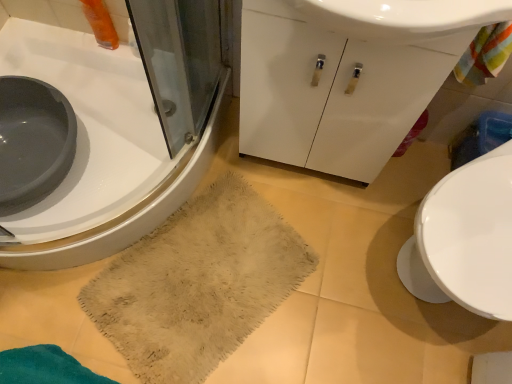
The image size is (512, 384). Find the location of `white glossy cabinet at center`. white glossy cabinet at center is located at coordinates (347, 75).

Where is `white glossy cabinet at center`? white glossy cabinet at center is located at coordinates (347, 75).

Is white glossy sink at lower left not within white glossy cabinet at center?

Yes, white glossy sink at lower left is outside of white glossy cabinet at center.

Which is more to the right, white glossy sink at lower left or white glossy cabinet at center?

Positioned to the right is white glossy cabinet at center.

Between white glossy sink at lower left and white glossy cabinet at center, which one has smaller width?

With smaller width is white glossy cabinet at center.

Visually, is white glossy sink at lower left positioned to the left or to the right of beige fuzzy rug at lower center?

white glossy sink at lower left is positioned on beige fuzzy rug at lower center's left side.

Is point (73, 101) less distant than point (149, 382)?

No, it is not.

Is white glossy sink at lower left not close to beige fuzzy rug at lower center?

No, there isn't a large distance between white glossy sink at lower left and beige fuzzy rug at lower center.

Does point (227, 191) come closer to viewer compared to point (386, 148)?

No, it is behind (386, 148).

What's the angular difference between beige fuzzy rug at lower center and white glossy cabinet at center's facing directions?

The angle between the facing direction of beige fuzzy rug at lower center and the facing direction of white glossy cabinet at center is 27.6 degrees.

Is beige fuzzy rug at lower center at the right side of white glossy cabinet at center?

No, beige fuzzy rug at lower center is not to the right of white glossy cabinet at center.

Is point (214, 321) closer or farther from the camera than point (19, 264)?

Point (214, 321) is positioned farther from the camera compared to point (19, 264).

How different are the orientations of beige fuzzy rug at lower center and white glossy sink at lower left in degrees?

The facing directions of beige fuzzy rug at lower center and white glossy sink at lower left are 118 degrees apart.

From a real-world perspective, is beige fuzzy rug at lower center physically located above or below white glossy sink at lower left?

From a real-world perspective, beige fuzzy rug at lower center is physically below white glossy sink at lower left.

Is beige fuzzy rug at lower center directly adjacent to white glossy sink at lower left?

beige fuzzy rug at lower center is not next to white glossy sink at lower left, and they're not touching.

Is white glossy cabinet at center with white glossy sink at lower left?

white glossy cabinet at center is not next to white glossy sink at lower left, and they're not touching.

From a real-world perspective, is white glossy cabinet at center below white glossy sink at lower left?

No, from a real-world perspective, white glossy cabinet at center is not beneath white glossy sink at lower left.

From the image's perspective, which is above, white glossy cabinet at center or white glossy sink at lower left?

white glossy cabinet at center.

Considering the relative sizes of white glossy cabinet at center and white glossy sink at lower left in the image provided, is white glossy cabinet at center bigger than white glossy sink at lower left?

Incorrect, white glossy cabinet at center is not larger than white glossy sink at lower left.

Between point (360, 93) and point (233, 207), which one is positioned in front?

The point (360, 93) is closer.

Is white glossy cabinet at center in contact with beige fuzzy rug at lower center?

white glossy cabinet at center is not next to beige fuzzy rug at lower center, and they're not touching.

Considering the sizes of white glossy cabinet at center and beige fuzzy rug at lower center in the image, is white glossy cabinet at center wider or thinner than beige fuzzy rug at lower center?

Considering their sizes, white glossy cabinet at center looks slimmer than beige fuzzy rug at lower center.

Locate an element on the screen. This screenshot has width=512, height=384. sink directly beneath the white glossy cabinet at center (from a real-world perspective) is located at coordinates (100, 151).

The width and height of the screenshot is (512, 384). In order to click on bath towel on the right of white glossy sink at lower left in this screenshot , I will do `click(198, 283)`.

Based on their spatial positions, is white glossy sink at lower left or white glossy cabinet at center further from beige fuzzy rug at lower center?

white glossy cabinet at center lies further to beige fuzzy rug at lower center than the other object.

Based on their spatial positions, is white glossy cabinet at center or white glossy sink at lower left further from beige fuzzy rug at lower center?

Based on the image, white glossy cabinet at center appears to be further to beige fuzzy rug at lower center.

Based on their spatial positions, is beige fuzzy rug at lower center or white glossy cabinet at center closer to white glossy sink at lower left?

beige fuzzy rug at lower center lies closer to white glossy sink at lower left than the other object.

Estimate the real-world distances between objects in this image. Which object is further from white glossy sink at lower left, white glossy cabinet at center or beige fuzzy rug at lower center?

white glossy cabinet at center lies further to white glossy sink at lower left than the other object.

Considering their positions, is beige fuzzy rug at lower center positioned further to white glossy cabinet at center than white glossy sink at lower left?

white glossy sink at lower left.

Which object lies further to the anchor point white glossy cabinet at center, white glossy sink at lower left or beige fuzzy rug at lower center?

white glossy sink at lower left is positioned further to the anchor white glossy cabinet at center.

What are the coordinates of `bath towel between white glossy sink at lower left and white glossy cabinet at center from left to right` in the screenshot? It's located at (198, 283).